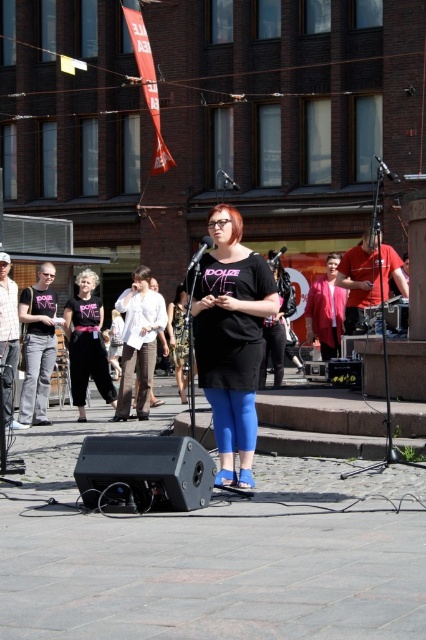
Measure the distance between point (154, 307) and camera.

Point (154, 307) is 14.64 meters from camera.

Can you confirm if white cotton shirt at center is positioned to the right of pink fabric jacket at center?

In fact, white cotton shirt at center is to the left of pink fabric jacket at center.

Is point (146, 344) more distant than point (334, 264)?

No, it is not.

At what (x,y) coordinates should I click in order to perform the action: click on white cotton shirt at center. Please return your answer as a coordinate pair (x, y). Looking at the image, I should click on (138, 342).

Which is in front, point (365, 237) or point (233, 186)?

Point (365, 237)

How distant is matte red shirt at center from metallic silver microphone at center?

A distance of 16.64 meters exists between matte red shirt at center and metallic silver microphone at center.

Is point (347, 308) more distant than point (221, 170)?

No, (347, 308) is in front of (221, 170).

Where is `matte red shirt at center`? matte red shirt at center is located at coordinates (368, 278).

Who is more forward, (203, 326) or (339, 278)?

Point (203, 326)

Does black matte dress at center appear over matte red shirt at center?

No.

Is point (250, 332) more distant than point (371, 298)?

That is False.

Locate an element on the screen. black matte dress at center is located at coordinates (232, 339).